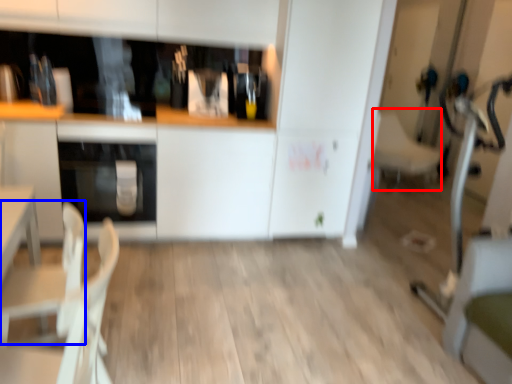
Question: Among these objects, which one is nearest to the camera, armchair (highlighted by a red box) or armchair (highlighted by a blue box)?

Choices:
 (A) armchair
 (B) armchair

Answer: (B)